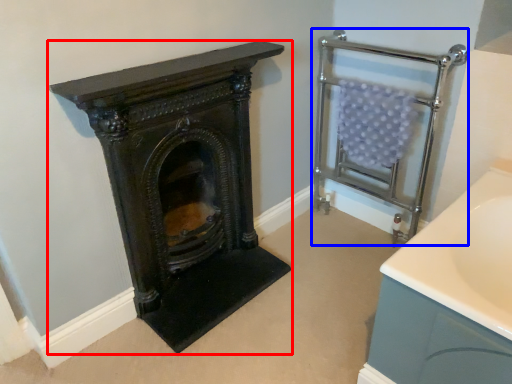
Question: Which of the following is the farthest to the observer, wood burning stove (highlighted by a red box) or balustrade (highlighted by a blue box)?

Choices:
 (A) wood burning stove
 (B) balustrade

Answer: (B)